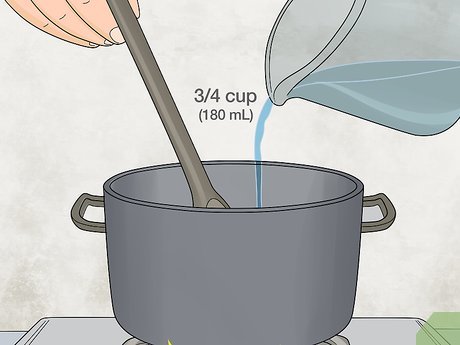
The height and width of the screenshot is (345, 460). Identify the location of burner. (328, 342).